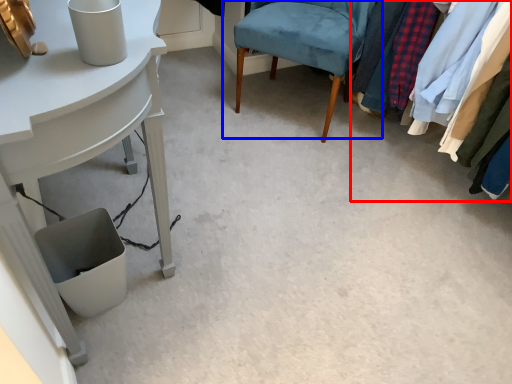
Question: Which object is further to the camera taking this photo, closet (highlighted by a red box) or chair (highlighted by a blue box)?

Choices:
 (A) closet
 (B) chair

Answer: (B)